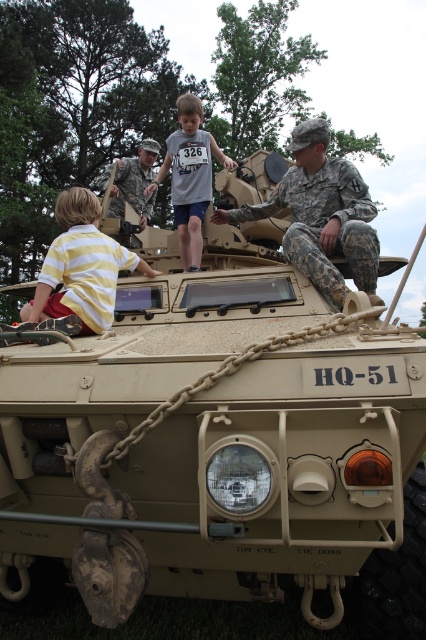
Which of these two, yellow striped shirt at left or gray cotton shirt at center, stands shorter?

With less height is gray cotton shirt at center.

Is yellow striped shirt at left shorter than gray cotton shirt at center?

No, yellow striped shirt at left is not shorter than gray cotton shirt at center.

Locate an element on the screen. Image resolution: width=426 pixels, height=640 pixels. yellow striped shirt at left is located at coordinates (81, 266).

Who is taller, camouflage fabric soldier at upper center or yellow striped shirt at left?

Standing taller between the two is camouflage fabric soldier at upper center.

Measure the distance between point (322, 244) and camera.

The distance of point (322, 244) from camera is 12.83 feet.

You are a GUI agent. You are given a task and a screenshot of the screen. Output one action in this format:
    pyautogui.click(x=<x>, y=<y>)
    Task: Click on the camouflage fabric soldier at upper center
    Image resolution: width=426 pixels, height=640 pixels.
    Given the screenshot: What is the action you would take?
    pyautogui.click(x=322, y=216)

Is gray cotton shirt at center positioned before camouflage uniform at upper center?

Yes, it is.

How distant is gray cotton shirt at center from camouflage uniform at upper center?

A distance of 7.92 feet exists between gray cotton shirt at center and camouflage uniform at upper center.

Where is `gray cotton shirt at center`? This screenshot has height=640, width=426. gray cotton shirt at center is located at coordinates (189, 177).

This screenshot has height=640, width=426. Identify the location of gray cotton shirt at center. (189, 177).